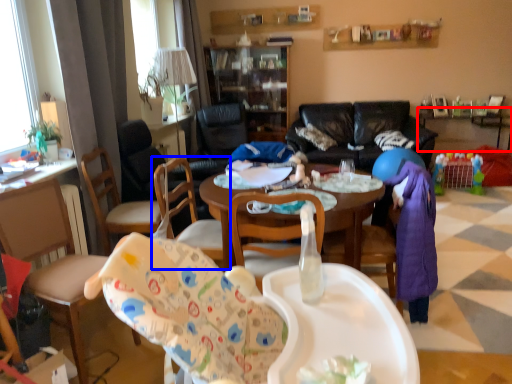
Question: Which object appears farthest to the camera in this image, table (highlighted by a red box) or chair (highlighted by a blue box)?

Choices:
 (A) table
 (B) chair

Answer: (A)